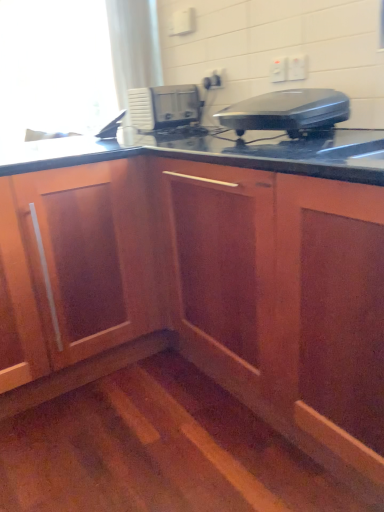
Question: Are white plastic microwave at center, which ranks as the 2th home appliance in front-to-back order, and white plastic electric outlet at upper right, the third electric outlet when ordered from back to front, far apart?

Choices:
 (A) no
 (B) yes

Answer: (A)

Question: Is white plastic electric outlet at upper right, the first electric outlet viewed from the right, at the back of white plastic microwave at center, which ranks as the 2th home appliance in front-to-back order?

Choices:
 (A) yes
 (B) no

Answer: (B)

Question: Can you confirm if white plastic microwave at center, the second home appliance when ordered from right to left, is shorter than white plastic electric outlet at upper right, the third electric outlet when ordered from back to front?

Choices:
 (A) no
 (B) yes

Answer: (A)

Question: From the image's perspective, is white plastic microwave at center, which is counted as the second home appliance, starting from the bottom, located above white plastic electric outlet at upper right, the 3th electric outlet from the left?

Choices:
 (A) no
 (B) yes

Answer: (B)

Question: Is white plastic microwave at center, placed as the 1th home appliance when sorted from left to right, positioned in front of white plastic electric outlet at upper right, the first electric outlet viewed from the right?

Choices:
 (A) no
 (B) yes

Answer: (A)

Question: Considering the positions of white plastic electric outlet at upper center, the second electric outlet positioned from the left, and white plastic electric outlet at upper right, the first electric outlet viewed from the right, in the image, is white plastic electric outlet at upper center, the second electric outlet positioned from the left, bigger or smaller than white plastic electric outlet at upper right, the first electric outlet viewed from the right,?

Choices:
 (A) small
 (B) big

Answer: (B)

Question: From the image's perspective, is white plastic electric outlet at upper center, which is the 2th electric outlet in front-to-back order, located above or below white plastic electric outlet at upper right, the first electric outlet viewed from the right?

Choices:
 (A) below
 (B) above

Answer: (B)

Question: From a real-world perspective, is white plastic electric outlet at upper center, which is counted as the second electric outlet, starting from the right, positioned above or below white plastic electric outlet at upper right, the first electric outlet viewed from the right?

Choices:
 (A) below
 (B) above

Answer: (A)

Question: Would you say white plastic electric outlet at upper center, the second electric outlet positioned from the left, is to the left or to the right of white plastic electric outlet at upper right, the first electric outlet viewed from the right, in the picture?

Choices:
 (A) right
 (B) left

Answer: (B)

Question: From the image's perspective, is white plastic electric outlet at upper center, arranged as the 2th electric outlet when viewed from the back, positioned above or below white plastic electric outlet at upper center, positioned as the third electric outlet in front-to-back order?

Choices:
 (A) above
 (B) below

Answer: (B)

Question: Based on their sizes in the image, would you say white plastic electric outlet at upper center, the second electric outlet positioned from the left, is bigger or smaller than white plastic electric outlet at upper center, arranged as the first electric outlet when viewed from the back?

Choices:
 (A) big
 (B) small

Answer: (A)

Question: In the image, is white plastic electric outlet at upper center, arranged as the 2th electric outlet when viewed from the back, positioned in front of or behind white plastic electric outlet at upper center, positioned as the third electric outlet in front-to-back order?

Choices:
 (A) front
 (B) behind

Answer: (A)

Question: From a real-world perspective, is white plastic electric outlet at upper center, the second electric outlet positioned from the left, above or below white plastic electric outlet at upper center, positioned as the third electric outlet in front-to-back order?

Choices:
 (A) above
 (B) below

Answer: (B)

Question: Would you say transparent glass window screen at upper left is inside or outside white plastic electric outlet at upper center, arranged as the 2th electric outlet when viewed from the back?

Choices:
 (A) outside
 (B) inside

Answer: (A)

Question: Would you say transparent glass window screen at upper left is to the left or to the right of white plastic electric outlet at upper center, which is the 2th electric outlet in front-to-back order, in the picture?

Choices:
 (A) left
 (B) right

Answer: (A)